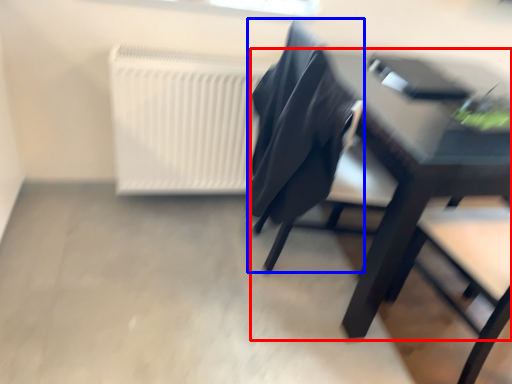
Question: Which object appears farthest to the camera in this image, table (highlighted by a red box) or chair (highlighted by a blue box)?

Choices:
 (A) table
 (B) chair

Answer: (B)